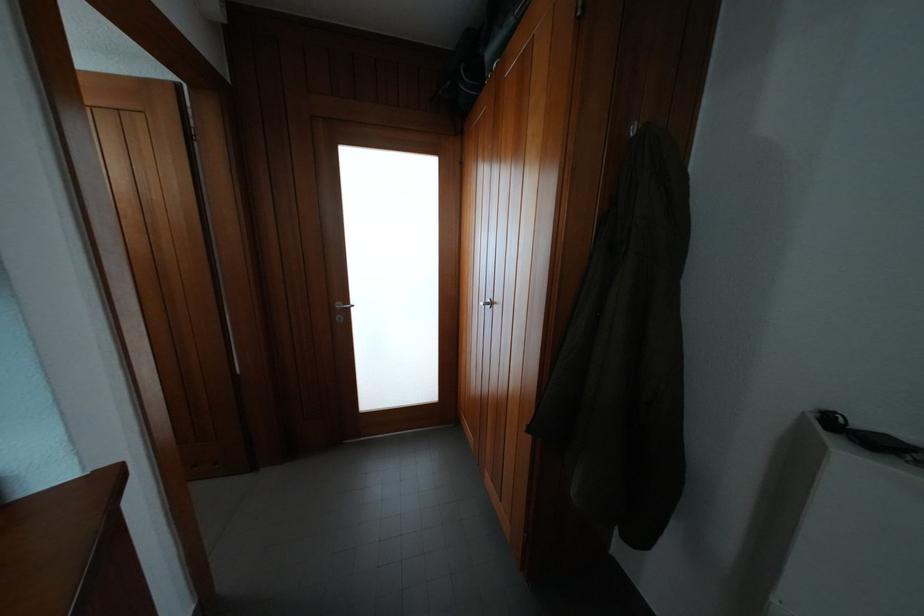
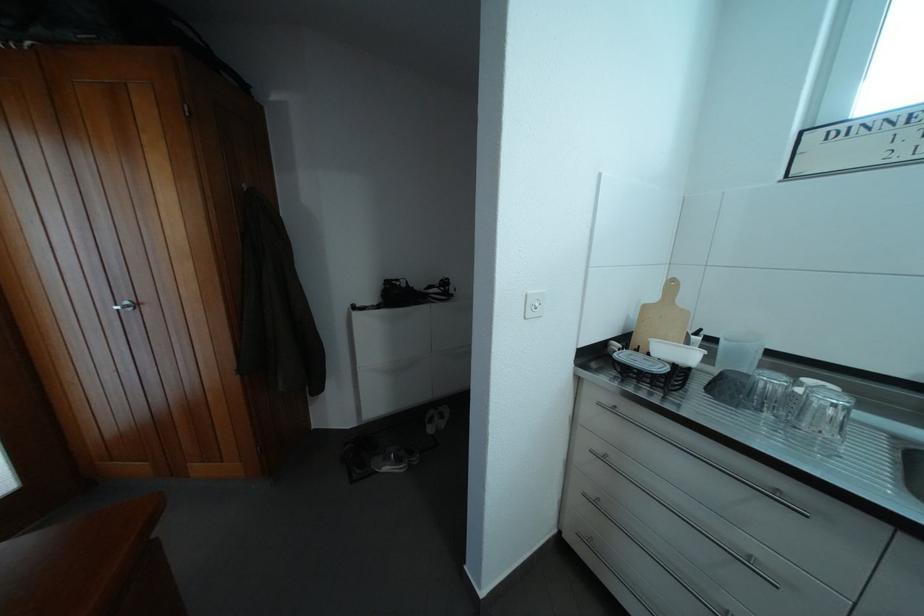
Question: The camera is either moving clockwise (left) or counter-clockwise (right) around the object. The first image is from the beginning of the video and the second image is from the end. Is the camera moving left or right when shooting the video?

Choices:
 (A) Left
 (B) Right

Answer: (A)